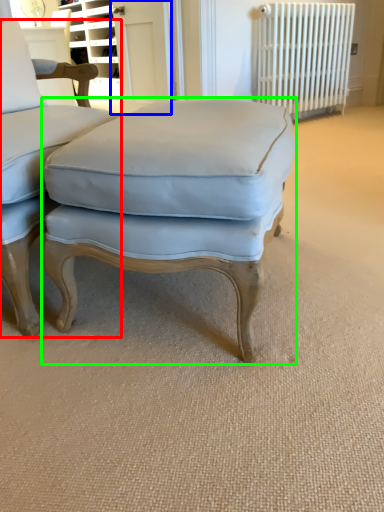
Question: Which object is positioned farthest from chair (highlighted by a red box)? Select from screen door (highlighted by a blue box) and stool (highlighted by a green box).

Choices:
 (A) screen door
 (B) stool

Answer: (A)